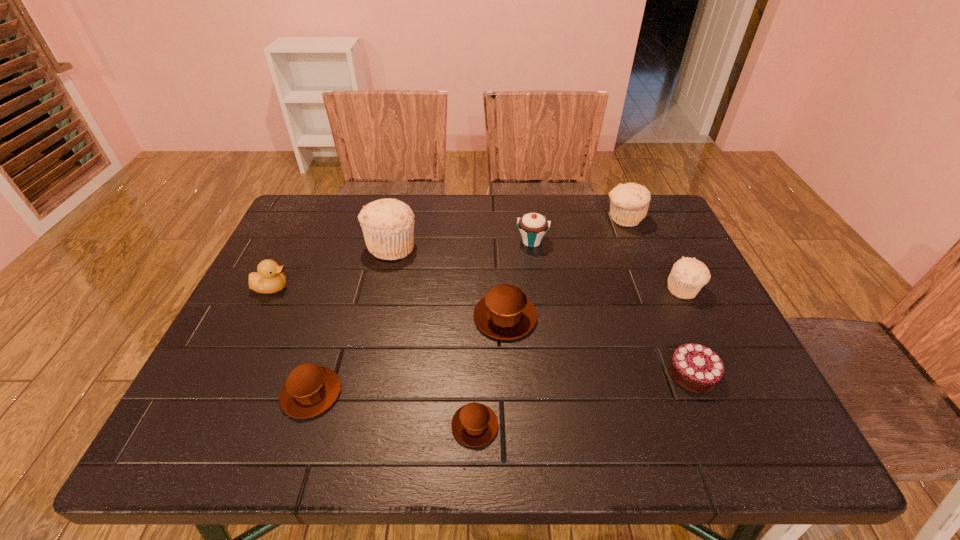
Locate an element on the screen. Image resolution: width=960 pixels, height=540 pixels. vacant area at the far left corner of the desktop is located at coordinates (300, 200).

Find the location of a particular element. This screenshot has width=960, height=540. free space at the far right corner of the desktop is located at coordinates (633, 228).

Locate an element on the screen. This screenshot has height=540, width=960. vacant point located between the eighth shortest object and the shortest object is located at coordinates (550, 322).

This screenshot has width=960, height=540. Identify the location of vacant space that is in between the smallest brown muffin and the chocolate chocolate cake. (584, 400).

At what (x,y) coordinates should I click in order to perform the action: click on free space between the cupcake and the nearest beige muffin. Please return your answer as a coordinate pair (x, y). The image size is (960, 540). Looking at the image, I should click on (608, 265).

You are a GUI agent. You are given a task and a screenshot of the screen. Output one action in this format:
    pyautogui.click(x=<x>, y=<y>)
    Task: Click on the vacant area that lies between the chocolate chocolate cake and the eighth shortest object
    The height and width of the screenshot is (540, 960).
    Given the screenshot: What is the action you would take?
    pyautogui.click(x=659, y=296)

Locate an element on the screen. empty space that is in between the smallest brown muffin and the chocolate cake is located at coordinates (584, 400).

Where is `vacant point located between the tallest muffin and the second tallest muffin`? Image resolution: width=960 pixels, height=540 pixels. vacant point located between the tallest muffin and the second tallest muffin is located at coordinates click(508, 232).

You are a GUI agent. You are given a task and a screenshot of the screen. Output one action in this format:
    pyautogui.click(x=<x>, y=<y>)
    Task: Click on the unoccupied position between the duckling and the teal cupcake
    
    Given the screenshot: What is the action you would take?
    pyautogui.click(x=402, y=265)

You are a GUI agent. You are given a task and a screenshot of the screen. Output one action in this format:
    pyautogui.click(x=<x>, y=<y>)
    Task: Click on the vacant region between the shortest object and the biggest beige muffin
    Image resolution: width=960 pixels, height=540 pixels.
    Given the screenshot: What is the action you would take?
    pos(433,336)